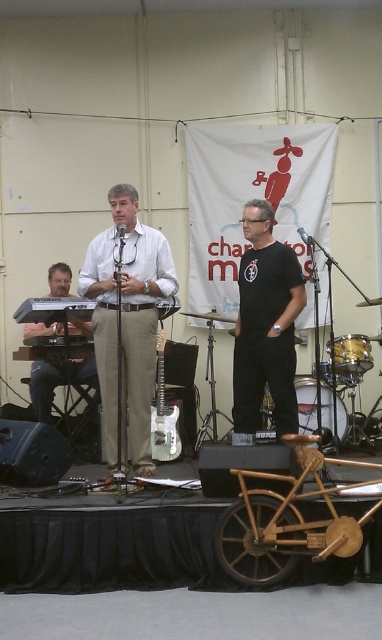
Between matte black keyboard at left and satin white electric guitar at center, which one is positioned lower?

satin white electric guitar at center is below.

Does point (58, 323) come farther from viewer compared to point (158, 451)?

Yes, point (58, 323) is behind point (158, 451).

Describe the element at coordinates (58, 381) in the screenshot. This screenshot has width=382, height=640. I see `matte black keyboard at left` at that location.

I want to click on matte black keyboard at left, so click(58, 381).

Is matte white shirt at center to the right of satin white electric guitar at center from the viewer's perspective?

Incorrect, matte white shirt at center is not on the right side of satin white electric guitar at center.

Is matte white shirt at center positioned in front of satin white electric guitar at center?

Yes, it is in front of satin white electric guitar at center.

Between point (168, 292) and point (157, 368), which one is positioned in front?

Point (168, 292) is in front.

What are the coordinates of `matte white shirt at center` in the screenshot? It's located at (126, 323).

Who is positioned more to the left, satin white electric guitar at center or black matte microphone at center?

Positioned to the left is black matte microphone at center.

Does satin white electric guitar at center come behind black matte microphone at center?

Yes, it is.

What do you see at coordinates (163, 413) in the screenshot?
I see `satin white electric guitar at center` at bounding box center [163, 413].

Find the location of a particular element. The image size is (382, 640). satin white electric guitar at center is located at coordinates (163, 413).